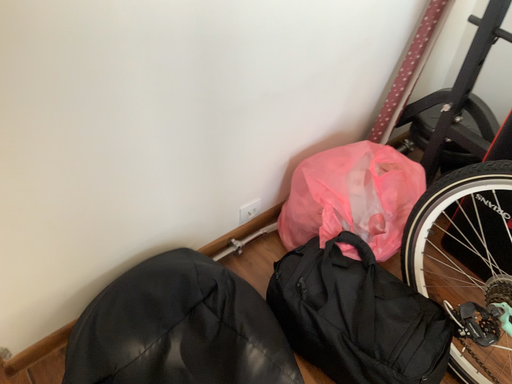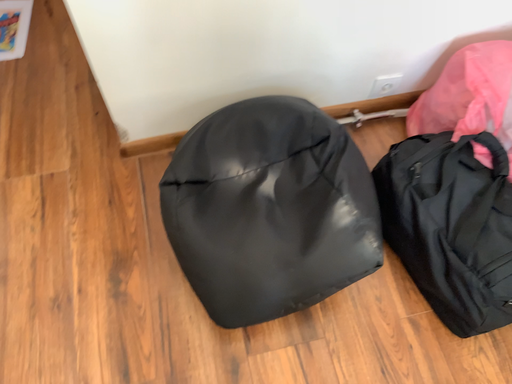
Question: Which way did the camera rotate in the video?

Choices:
 (A) rotated upward
 (B) rotated downward

Answer: (B)